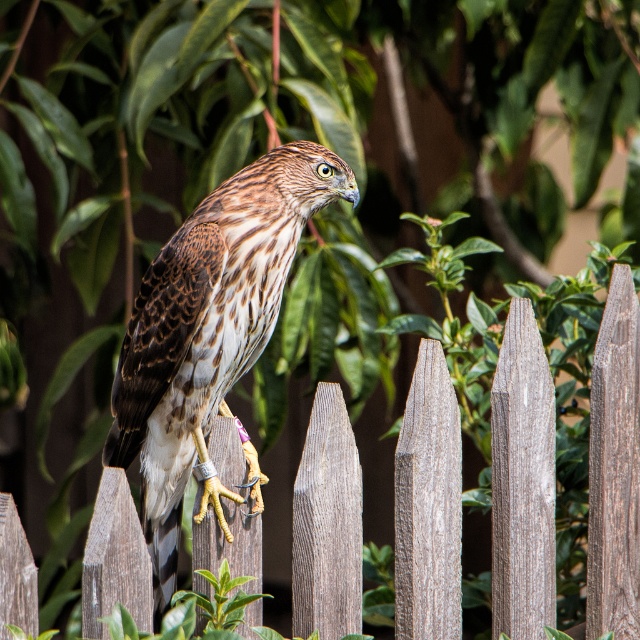
You are a birdwatcher observing the hawk in the image. You notice the wooden picket fence at center and the brown speckled feathers at center. Which object is positioned lower in the scene?

The wooden picket fence at center is positioned lower than the brown speckled feathers at center.

You are a researcher trying to locate the wooden picket fence at center in an image. What are the coordinates where you should look?

The wooden picket fence at center is located at coordinates point (522,481).

You are a photographer standing in front of a wooden picket fence at center where a hawk is perched. You want to take a photo of the hawk without getting too close. If your camera can focus clearly on objects up to 8 feet away, will you be able to take a clear photo of the hawk from your current position?

The wooden picket fence at center is 7.53 feet from viewer. Since the camera can focus up to 8 feet, the distance of 7.53 feet is within the camera range. Therefore, you can take a clear photo of the hawk from your current position.